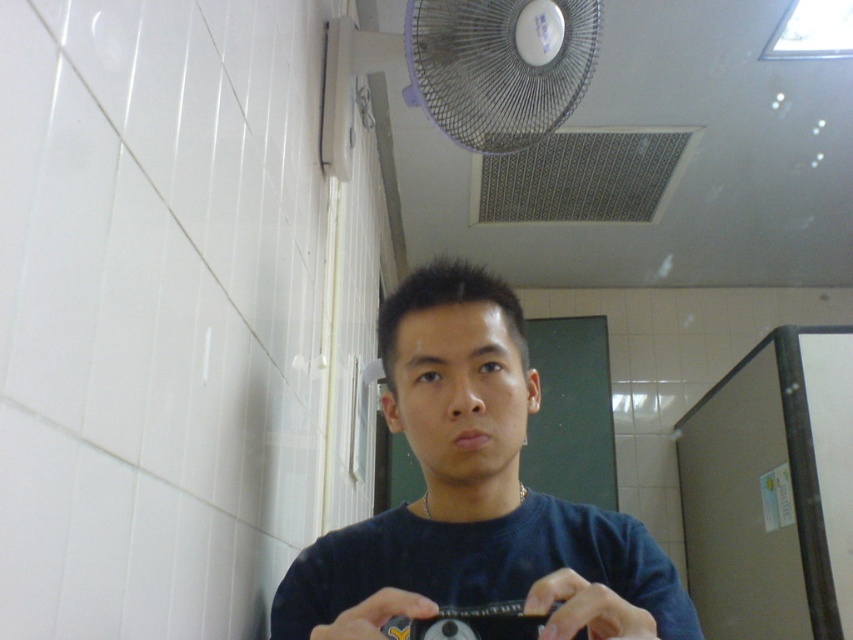
You are trying to determine where the point at coordinates (474, 493) is located in the image. Based on the scene description, which object does this point belong to?

The point at coordinates (474, 493) is on the dark blue T shirt at center.

You are trying to take a selfie in the bathroom and notice the white plastic fan at upper center and the black plastic camera at center. Which object is closer to you when you look through the camera lens?

The black plastic camera at center is behind the white plastic fan at upper center, so the white plastic fan at upper center is closer to you when looking through the camera lens.